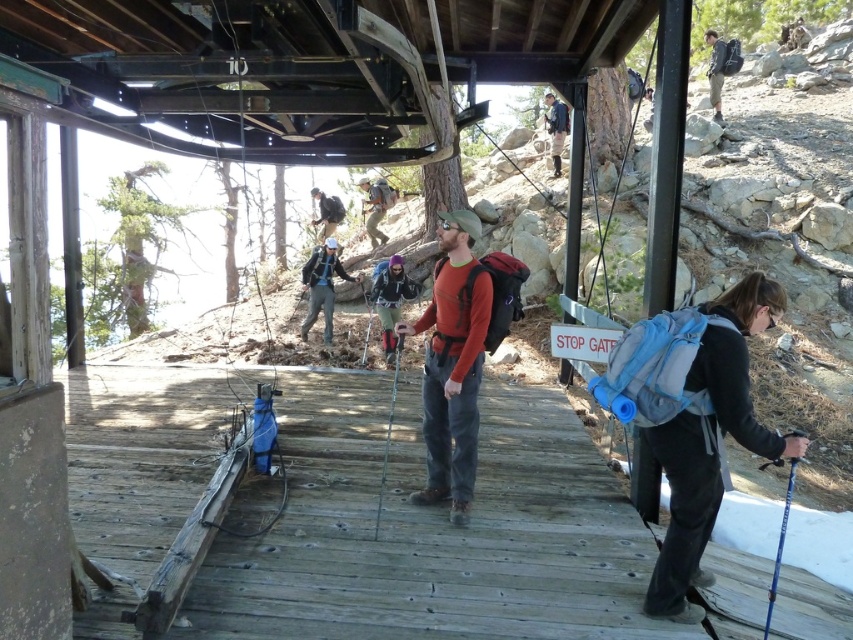
Is matte black backpack at center bigger than blue fabric backpack at upper center?

Incorrect, matte black backpack at center is not larger than blue fabric backpack at upper center.

Can you confirm if matte black backpack at center is positioned to the left of blue fabric backpack at upper center?

Yes, matte black backpack at center is to the left of blue fabric backpack at upper center.

What do you see at coordinates (321, 285) in the screenshot? The height and width of the screenshot is (640, 853). I see `matte black backpack at center` at bounding box center [321, 285].

The image size is (853, 640). In order to click on matte black backpack at center in this screenshot , I will do `click(321, 285)`.

Does blue metallic ski pole at lower right have a smaller size compared to matte gray backpack at center?

Actually, blue metallic ski pole at lower right might be larger than matte gray backpack at center.

Can you confirm if blue metallic ski pole at lower right is bigger than matte gray backpack at center?

Indeed, blue metallic ski pole at lower right has a larger size compared to matte gray backpack at center.

Which is behind, point (780, 545) or point (322, 193)?

The point (322, 193) is behind.

This screenshot has width=853, height=640. I want to click on blue metallic ski pole at lower right, so click(x=780, y=545).

Image resolution: width=853 pixels, height=640 pixels. I want to click on orange fleece jacket at center, so click(451, 365).

Measure the distance from orange fleece jacket at center to blue metallic ski pole at lower right.

orange fleece jacket at center is 5.93 feet from blue metallic ski pole at lower right.

The height and width of the screenshot is (640, 853). What are the coordinates of `orange fleece jacket at center` in the screenshot? It's located at (451, 365).